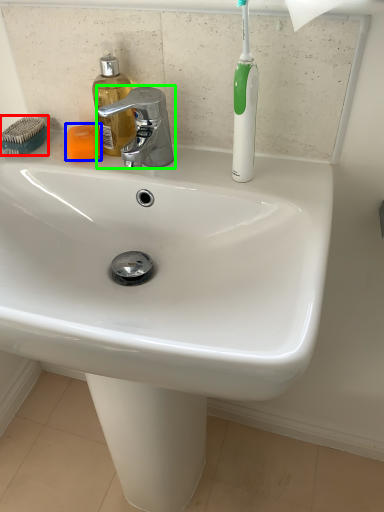
Question: Which object is the farthest from comb (highlighted by a red box)? Choose among these: soap (highlighted by a blue box) or tap (highlighted by a green box).

Choices:
 (A) soap
 (B) tap

Answer: (B)